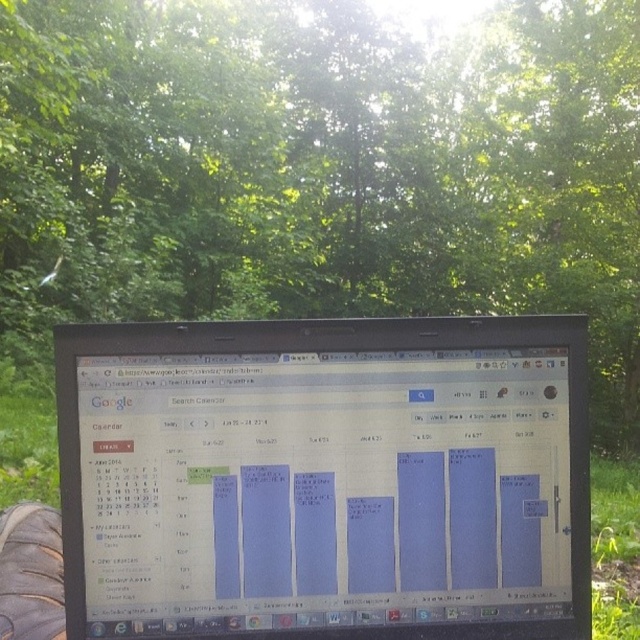
Question: Is green leafy tree at center to the right of matte plastic laptop at center from the viewer's perspective?

Choices:
 (A) no
 (B) yes

Answer: (B)

Question: Which object is farther from the camera taking this photo?

Choices:
 (A) matte plastic laptop at center
 (B) green leafy tree at center

Answer: (B)

Question: Is green leafy tree at center positioned in front of matte plastic laptop at center?

Choices:
 (A) yes
 (B) no

Answer: (B)

Question: Which of the following is the farthest from the observer?

Choices:
 (A) green leafy tree at center
 (B) matte plastic laptop at center

Answer: (A)

Question: Is green leafy tree at center above matte plastic laptop at center?

Choices:
 (A) yes
 (B) no

Answer: (A)